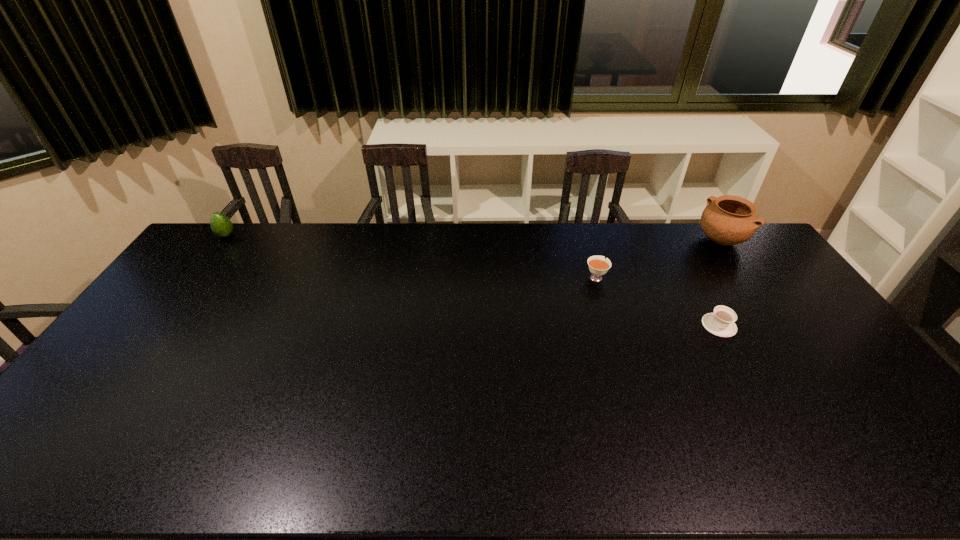
You are a GUI agent. You are given a task and a screenshot of the screen. Output one action in this format:
    pyautogui.click(x=<x>, y=<y>)
    Task: Click on the free space that satisfies the following two spatial constraints: 1. on the handle side of the tallest object; 2. on the left side of the shortest object
    The image size is (960, 540).
    Given the screenshot: What is the action you would take?
    pyautogui.click(x=672, y=240)